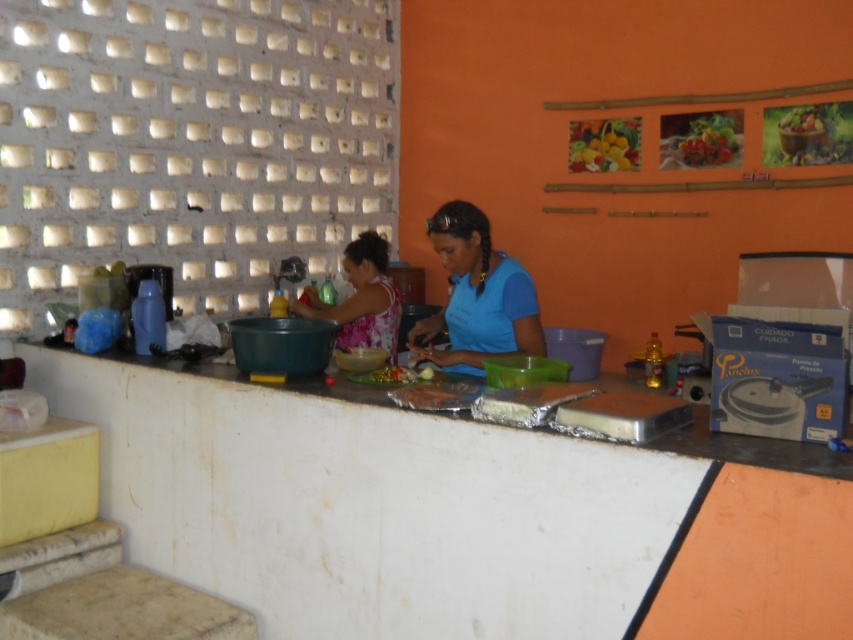
Which is behind, point (231, 408) or point (453, 339)?

Point (453, 339)

Which of these two, white matte counter at center or blue matte shirt at center, stands taller?

With more height is white matte counter at center.

Does point (485, 483) lie behind point (521, 268)?

No, (485, 483) is in front of (521, 268).

I want to click on white matte counter at center, so click(x=448, y=516).

Which of these two, marble-like stone stool at lower left or green leafy vegetables at center, stands shorter?

With less height is green leafy vegetables at center.

Who is more distant from viewer, (131, 564) or (381, 380)?

The point (131, 564) is more distant.

You are a GUI agent. You are given a task and a screenshot of the screen. Output one action in this format:
    pyautogui.click(x=<x>, y=<y>)
    Task: Click on the marble-like stone stool at lower left
    The height and width of the screenshot is (640, 853).
    Given the screenshot: What is the action you would take?
    pyautogui.click(x=122, y=611)

Who is shorter, marble-like stone stool at lower left or floral fabric shirt at center?

With less height is marble-like stone stool at lower left.

Does marble-like stone stool at lower left appear on the left side of floral fabric shirt at center?

Indeed, marble-like stone stool at lower left is positioned on the left side of floral fabric shirt at center.

Locate an element on the screen. The height and width of the screenshot is (640, 853). marble-like stone stool at lower left is located at coordinates (122, 611).

The width and height of the screenshot is (853, 640). I want to click on marble-like stone stool at lower left, so click(x=122, y=611).